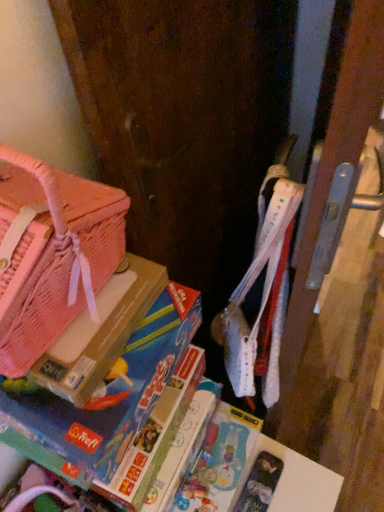
Question: Looking at their shapes, would you say blue cardboard game at left is wider or thinner than pink mesh bag at left?

Choices:
 (A) wide
 (B) thin

Answer: (A)

Question: Does point (165, 379) appear closer or farther from the camera than point (105, 308)?

Choices:
 (A) farther
 (B) closer

Answer: (A)

Question: Estimate the real-world distances between objects in this image. Which object is closer to the blue cardboard game at left?

Choices:
 (A) pink mesh bag at left
 (B) pink woven handbag at left

Answer: (A)

Question: Considering the real-world distances, which object is farthest from the blue cardboard game at left?

Choices:
 (A) pink woven handbag at left
 (B) pink mesh bag at left

Answer: (A)